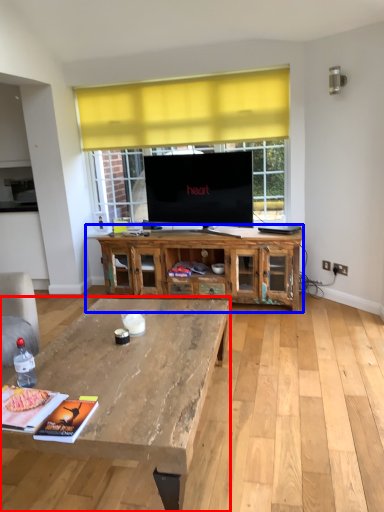
Question: Among these objects, which one is farthest to the camera, coffee table (highlighted by a red box) or cabinetry (highlighted by a blue box)?

Choices:
 (A) coffee table
 (B) cabinetry

Answer: (B)